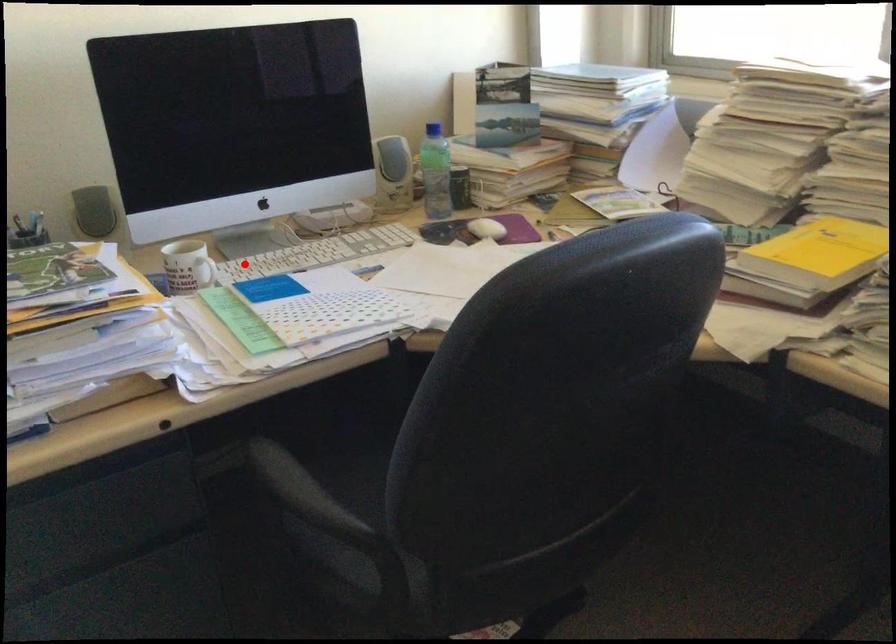
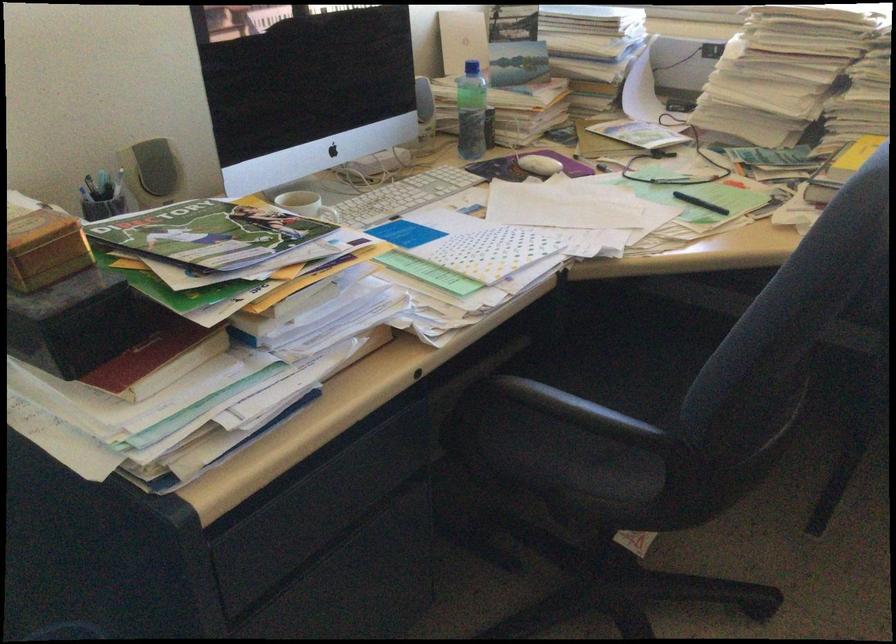
Where in the second image is the point corresponding to the highlighted location from the first image?

(334, 216)